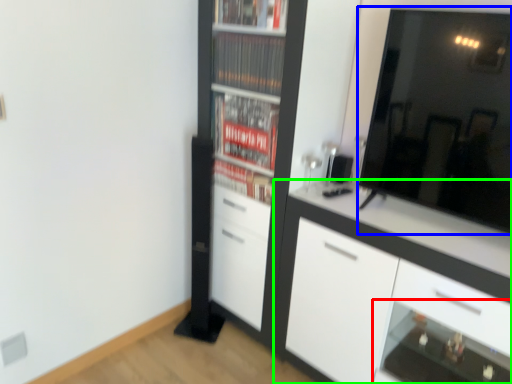
Question: Based on their relative distances, which object is nearer to shelf (highlighted by a red box)? Choose from mirror (highlighted by a blue box) and cabinetry (highlighted by a green box).

Choices:
 (A) mirror
 (B) cabinetry

Answer: (B)